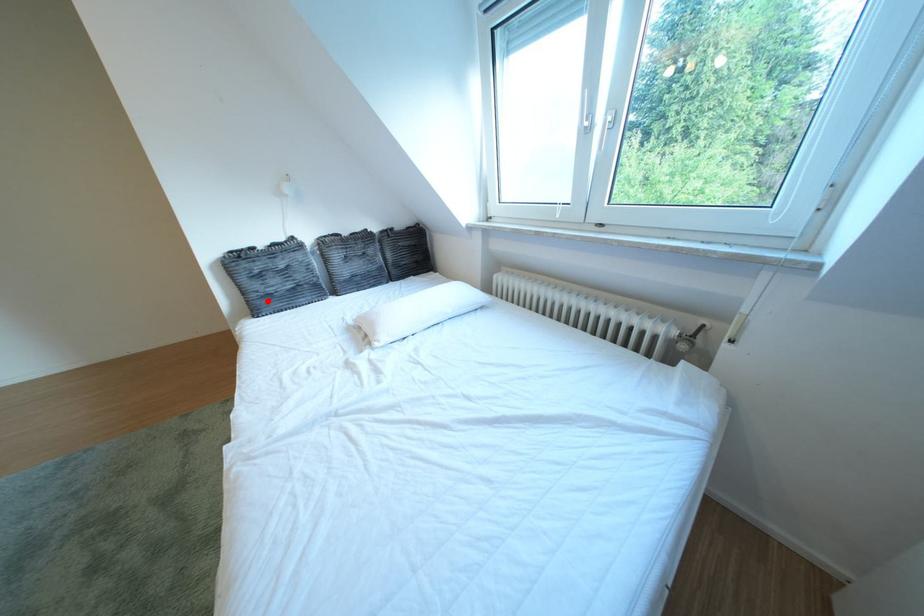
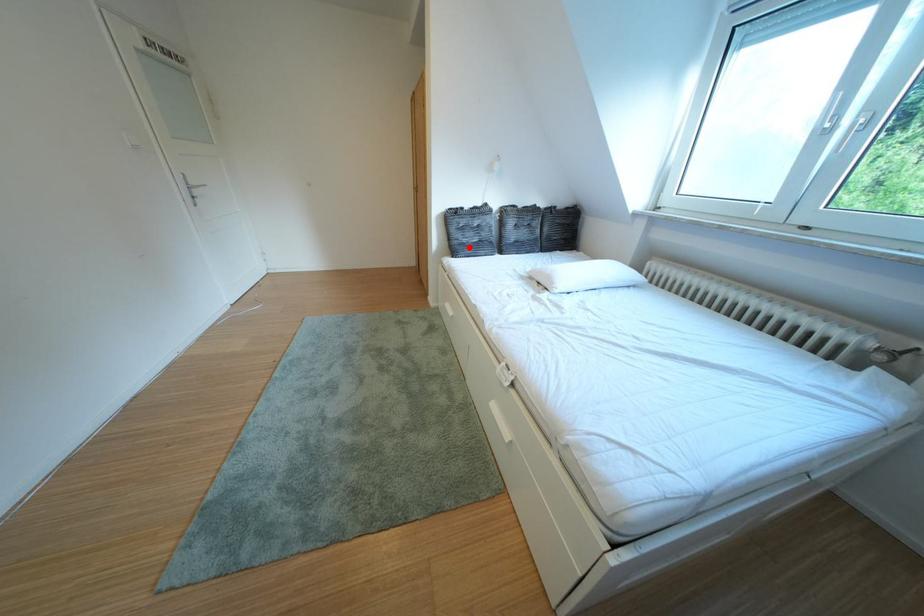
I am providing you with two images of the same scene from different viewpoints. A red point is marked on the first image and another point is marked on the second image. Is the marked point in image1 the same physical position as the marked point in image2?

Yes